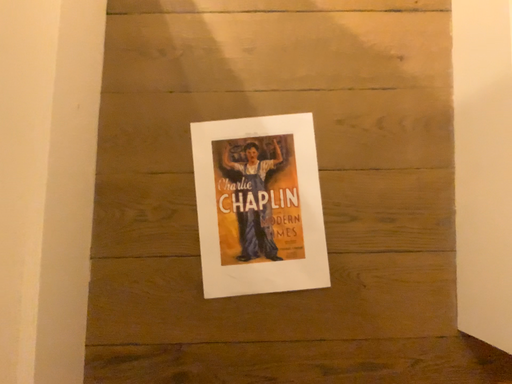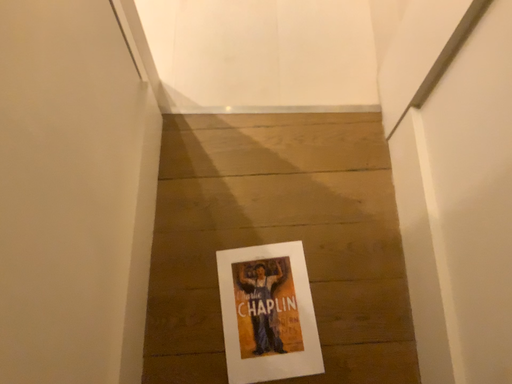
Question: Which way did the camera rotate in the video?

Choices:
 (A) rotated downward
 (B) rotated upward

Answer: (B)